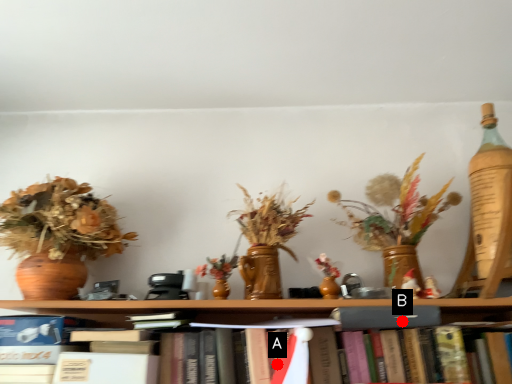
Question: Two points are circled on the image, labeled by A and B beside each circle. Which point is farther to the camera?

Choices:
 (A) A is further
 (B) B is further

Answer: (B)